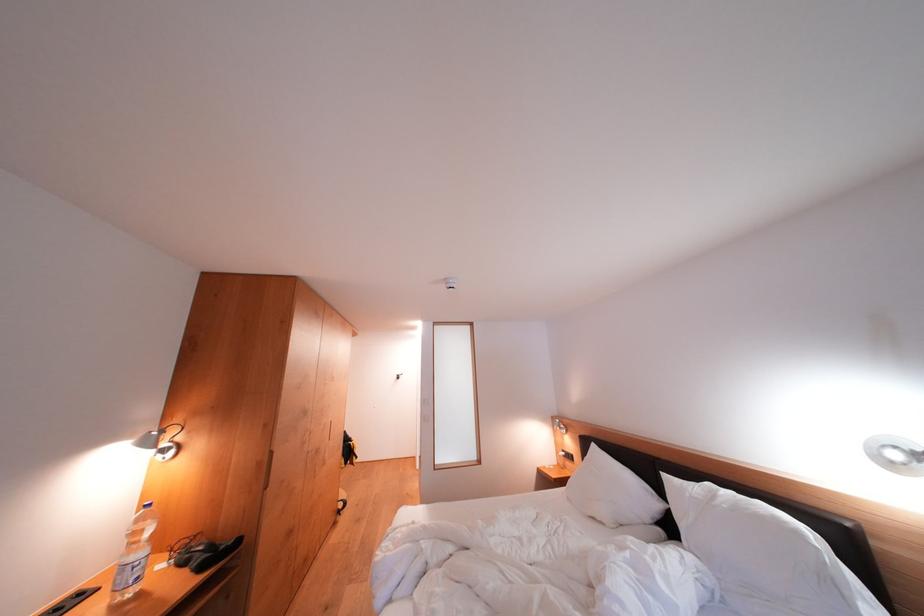
Where is `black telephone handset`? The height and width of the screenshot is (616, 924). black telephone handset is located at coordinates (201, 552).